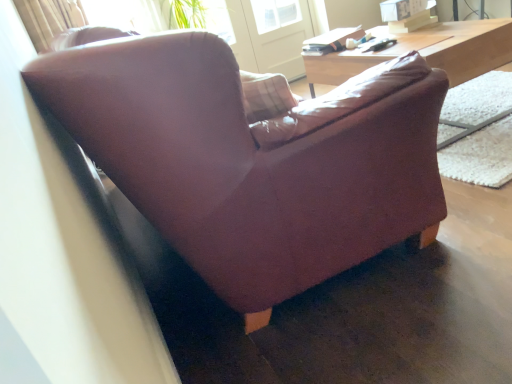
Question: Is wooden desk at upper right at the right side of transparent glass screen door at upper center?

Choices:
 (A) no
 (B) yes

Answer: (B)

Question: From the image's perspective, is wooden desk at upper right on top of transparent glass screen door at upper center?

Choices:
 (A) no
 (B) yes

Answer: (A)

Question: Is wooden desk at upper right far from transparent glass screen door at upper center?

Choices:
 (A) no
 (B) yes

Answer: (B)

Question: Can you confirm if wooden desk at upper right is smaller than transparent glass screen door at upper center?

Choices:
 (A) no
 (B) yes

Answer: (A)

Question: Is transparent glass screen door at upper center inside wooden desk at upper right?

Choices:
 (A) no
 (B) yes

Answer: (A)

Question: In the image, is wooden desk at upper right on the left side or the right side of leather couch at center?

Choices:
 (A) right
 (B) left

Answer: (A)

Question: Relative to leather couch at center, is wooden desk at upper right in front or behind?

Choices:
 (A) front
 (B) behind

Answer: (B)

Question: Choose the correct answer: Is wooden desk at upper right inside leather couch at center or outside it?

Choices:
 (A) inside
 (B) outside

Answer: (B)

Question: From the image's perspective, relative to leather couch at center, is wooden desk at upper right above or below?

Choices:
 (A) above
 (B) below

Answer: (A)

Question: Considering the relative positions of transparent glass screen door at upper center and leather couch at center in the image provided, is transparent glass screen door at upper center to the left or to the right of leather couch at center?

Choices:
 (A) right
 (B) left

Answer: (B)

Question: Considering their positions, is transparent glass screen door at upper center located in front of or behind leather couch at center?

Choices:
 (A) behind
 (B) front

Answer: (A)

Question: Looking at their shapes, would you say transparent glass screen door at upper center is wider or thinner than leather couch at center?

Choices:
 (A) wide
 (B) thin

Answer: (B)

Question: From the image's perspective, relative to leather couch at center, is transparent glass screen door at upper center above or below?

Choices:
 (A) above
 (B) below

Answer: (A)

Question: Is point (291, 9) closer or farther from the camera than point (473, 54)?

Choices:
 (A) farther
 (B) closer

Answer: (A)

Question: From their relative heights in the image, would you say transparent glass screen door at upper center is taller or shorter than wooden desk at upper right?

Choices:
 (A) tall
 (B) short

Answer: (A)